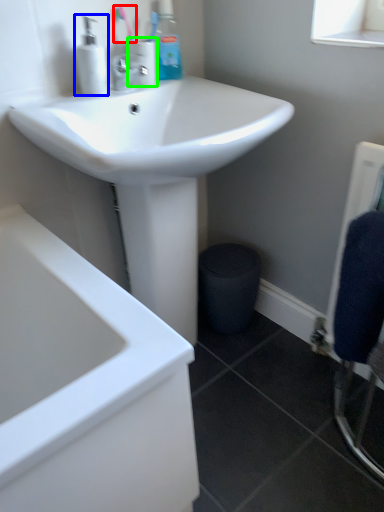
Question: Which object is positioned closest to toothbrush (highlighted by a red box)? Select from soap dispenser (highlighted by a blue box) and toiletry (highlighted by a green box).

Choices:
 (A) soap dispenser
 (B) toiletry

Answer: (B)